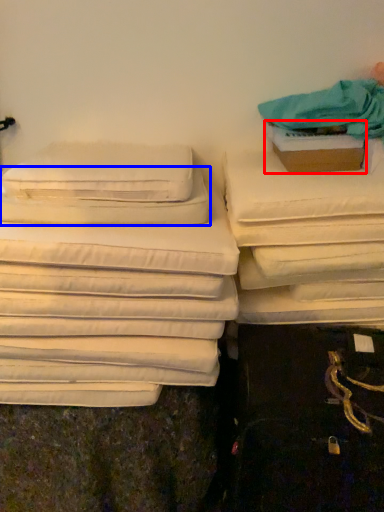
Question: Which object appears farthest to the camera in this image, cardboard box (highlighted by a red box) or pillow (highlighted by a blue box)?

Choices:
 (A) cardboard box
 (B) pillow

Answer: (A)